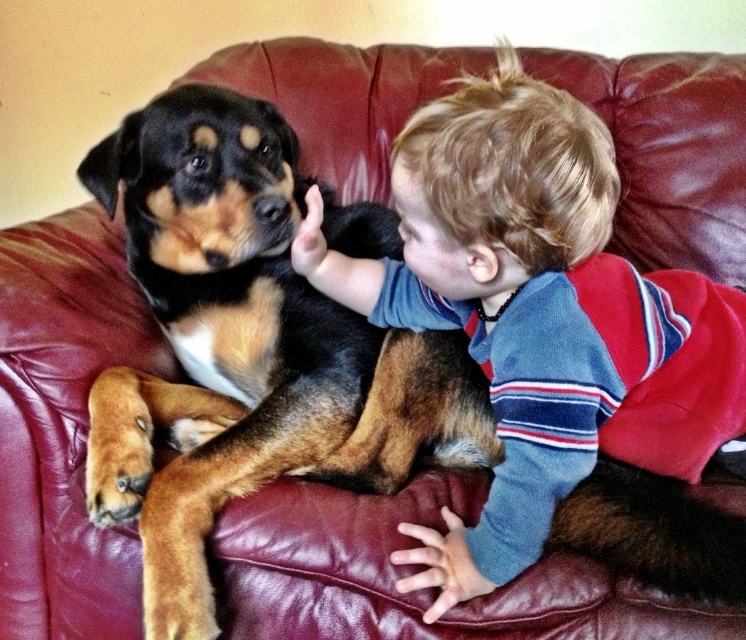
Describe the element at coordinates (248, 349) in the screenshot. I see `brown and black fur at center` at that location.

Is brown and black fur at center positioned before smooth blond hair at upper right?

No, it is not.

What do you see at coordinates (248, 349) in the screenshot?
I see `brown and black fur at center` at bounding box center [248, 349].

Identify the location of brown and black fur at center. (248, 349).